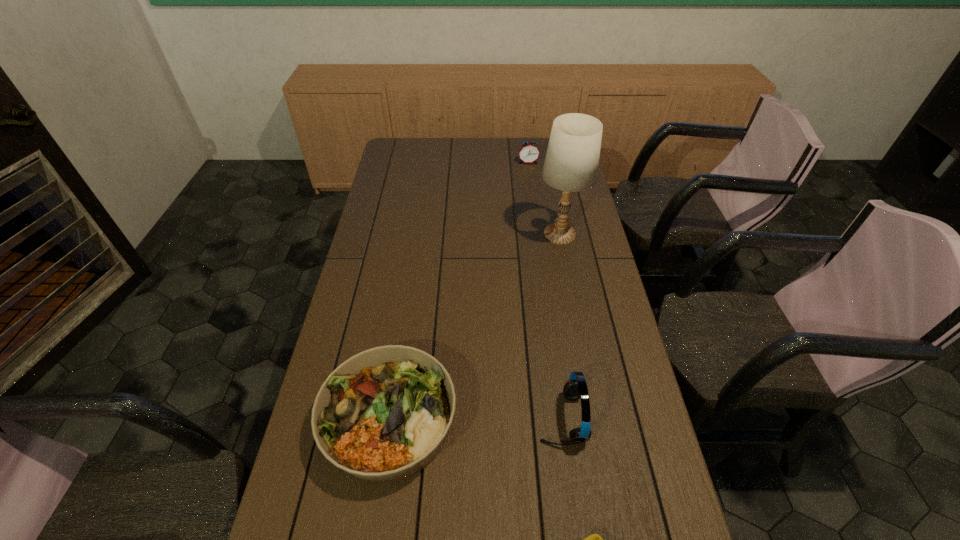
Where is `free spot located 0.400m on the back of the leftmost object`? This screenshot has width=960, height=540. free spot located 0.400m on the back of the leftmost object is located at coordinates (414, 265).

What are the coordinates of `object situated at the far edge` in the screenshot? It's located at (529, 152).

I want to click on object that is at the left edge, so click(384, 414).

The image size is (960, 540). In order to click on lamp located at the right edge in this screenshot , I will do `click(571, 164)`.

Locate an element on the screen. headset located at the right edge is located at coordinates (575, 388).

The height and width of the screenshot is (540, 960). What are the coordinates of `vacant space at the far edge` in the screenshot? It's located at click(x=477, y=153).

Find the location of a particular element. This screenshot has width=960, height=540. vacant space at the left edge of the desktop is located at coordinates (380, 295).

The width and height of the screenshot is (960, 540). In order to click on free spot at the right edge of the desktop in this screenshot , I will do `click(584, 214)`.

Find the location of a particular element. This screenshot has width=960, height=540. vacant space at the far left corner of the desktop is located at coordinates (390, 147).

The image size is (960, 540). I want to click on empty space between the alarm clock and the tallest object, so click(x=544, y=198).